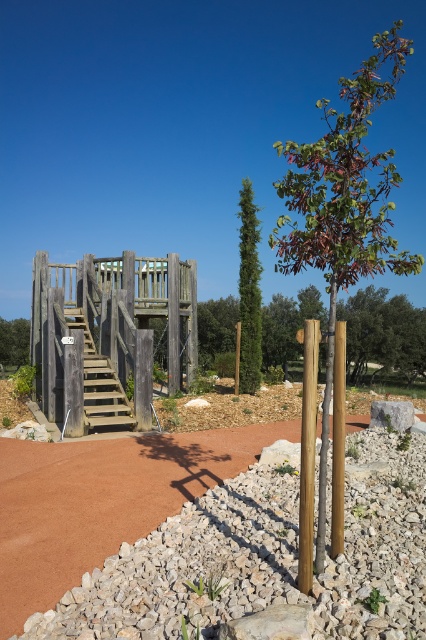
Looking at this image, can you confirm if wooden stairs at center is positioned to the left of brown wooden tree at left?

In fact, wooden stairs at center is to the right of brown wooden tree at left.

Can you confirm if wooden stairs at center is positioned above brown wooden tree at left?

No, wooden stairs at center is not above brown wooden tree at left.

Image resolution: width=426 pixels, height=640 pixels. Describe the element at coordinates (98, 381) in the screenshot. I see `wooden stairs at center` at that location.

Locate an element on the screen. wooden stairs at center is located at coordinates (98, 381).

Measure the distance between smooth brown pole at right and wooden stairs at center.

smooth brown pole at right is 25.59 feet away from wooden stairs at center.

Can you confirm if smooth brown pole at right is wider than wooden stairs at center?

Incorrect, smooth brown pole at right's width does not surpass wooden stairs at center's.

This screenshot has height=640, width=426. Describe the element at coordinates (307, 452) in the screenshot. I see `smooth brown pole at right` at that location.

Where is `smooth brown pole at right`? The width and height of the screenshot is (426, 640). smooth brown pole at right is located at coordinates (307, 452).

Is point (391, 148) positioned after point (108, 362)?

Yes, point (391, 148) is behind point (108, 362).

The width and height of the screenshot is (426, 640). I want to click on green matte tree at right, so pyautogui.click(x=344, y=204).

Does point (345, 92) lie behind point (103, 385)?

That is False.

The image size is (426, 640). I want to click on green matte tree at right, so click(344, 204).